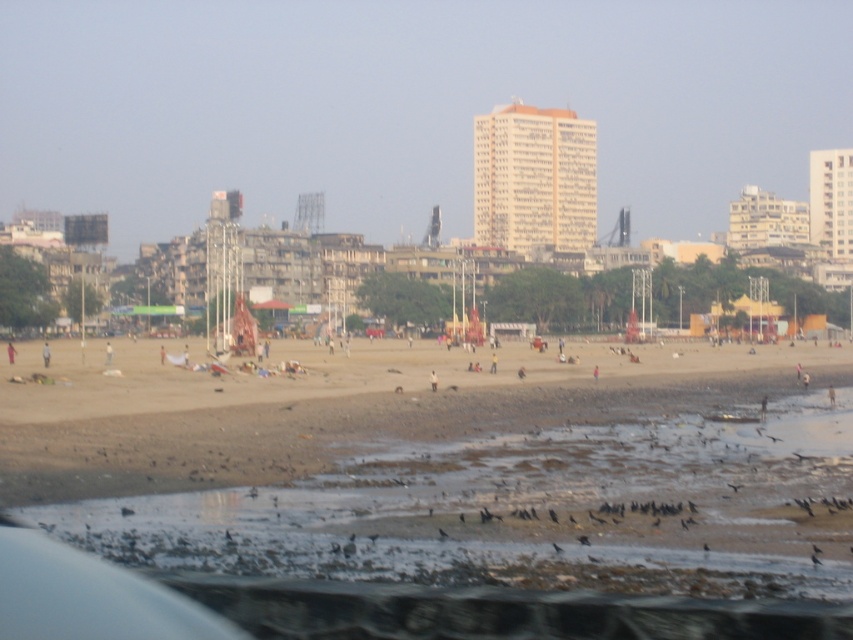
Is brown mudflat at lower center thinner than brown sand at lower center?

Correct, brown mudflat at lower center's width is less than brown sand at lower center's.

Which is more to the right, brown mudflat at lower center or brown sand at lower center?

Positioned to the right is brown mudflat at lower center.

The image size is (853, 640). I want to click on brown mudflat at lower center, so click(531, 509).